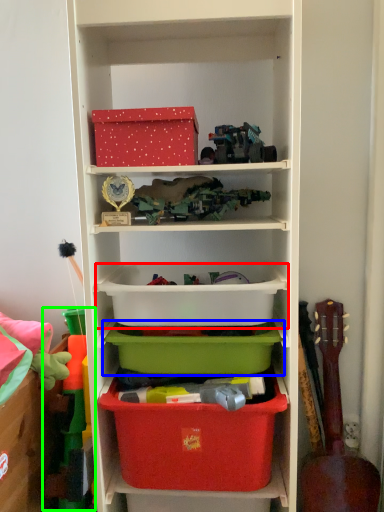
Question: Estimate the real-world distances between objects in this image. Which object is closer to storage box (highlighted by a red box), storage box (highlighted by a blue box) or toy (highlighted by a green box)?

Choices:
 (A) storage box
 (B) toy

Answer: (A)